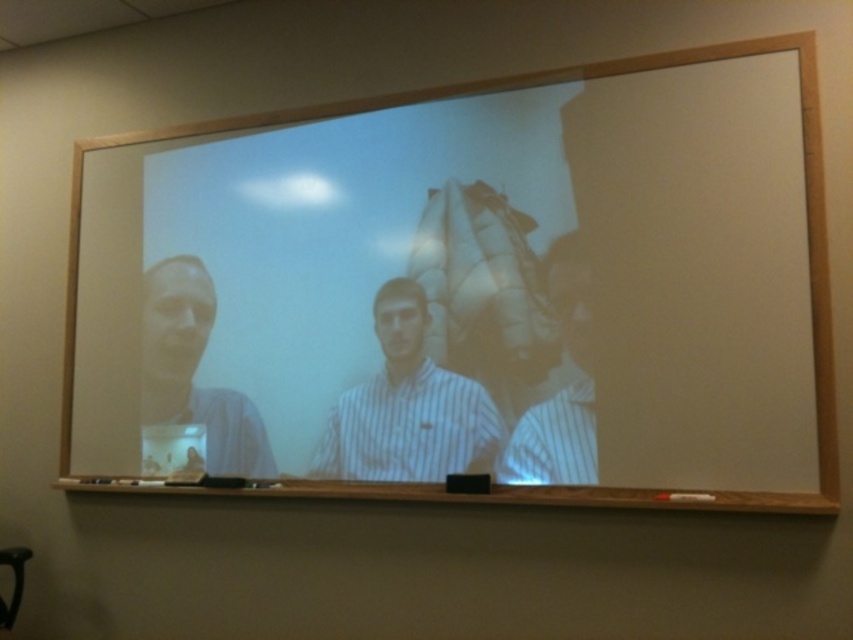
Question: Among these points, which one is farthest from the camera?

Choices:
 (A) (225, 404)
 (B) (91, 356)
 (C) (439, 445)

Answer: (B)

Question: Among these objects, which one is nearest to the camera?

Choices:
 (A) white striped shirt at center
 (B) wooden frame at center

Answer: (B)

Question: Which point is closer to the camera?

Choices:
 (A) wooden frame at center
 (B) white striped shirt at center
 (C) matte plastic cup at left

Answer: (A)

Question: Does white striped shirt at center appear on the right side of matte plastic cup at left?

Choices:
 (A) no
 (B) yes

Answer: (B)

Question: From the image, what is the correct spatial relationship of wooden frame at center in relation to white striped shirt at center?

Choices:
 (A) above
 (B) below

Answer: (A)

Question: Is wooden frame at center positioned before white striped shirt at center?

Choices:
 (A) no
 (B) yes

Answer: (B)